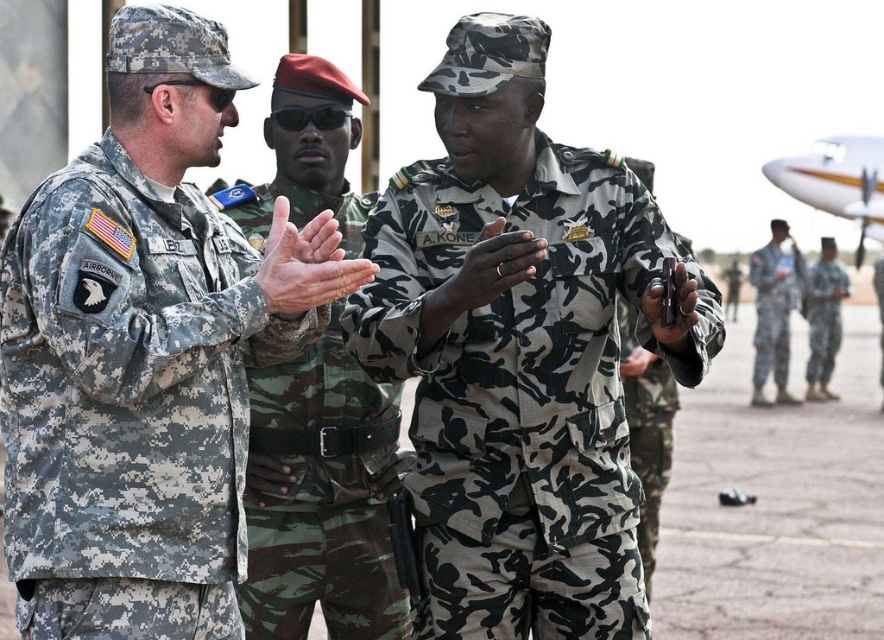
Is digital camouflage uniform at left further to camera compared to camouflage fabric uniform at right?

No, it is not.

Which is in front, point (225, 445) or point (809, 275)?

Positioned in front is point (225, 445).

Is point (187, 586) positioned after point (831, 285)?

No, (187, 586) is in front of (831, 285).

Locate an element on the screen. The width and height of the screenshot is (884, 640). digital camouflage uniform at left is located at coordinates (128, 380).

Is point (516, 582) farther from camera compared to point (764, 307)?

No.

Is camouflage fabric uniform at center to the left of camouflage uniform at right from the viewer's perspective?

Yes, camouflage fabric uniform at center is to the left of camouflage uniform at right.

What do you see at coordinates (523, 387) in the screenshot?
I see `camouflage fabric uniform at center` at bounding box center [523, 387].

Find the location of `camouflage fabric uniform at center`. camouflage fabric uniform at center is located at coordinates (523, 387).

Does camouflage fabric uniform at center appear over camouflage uniform at center?

Actually, camouflage fabric uniform at center is below camouflage uniform at center.

Between camouflage fabric uniform at center and camouflage uniform at center, which one has less height?

camouflage fabric uniform at center is shorter.

Where is `camouflage fabric uniform at center`? Image resolution: width=884 pixels, height=640 pixels. camouflage fabric uniform at center is located at coordinates (523, 387).